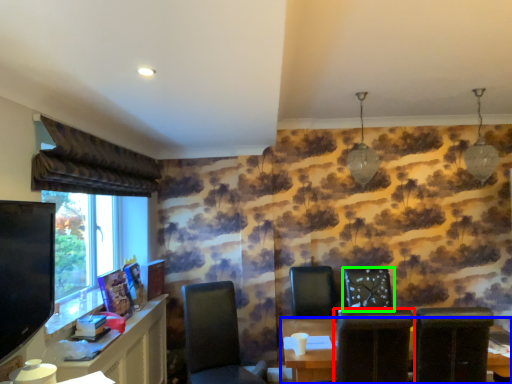
Question: Considering the real-world distances, which object is farthest from chair (highlighted by a red box)? table (highlighted by a blue box) or chair (highlighted by a green box)?

Choices:
 (A) table
 (B) chair

Answer: (B)